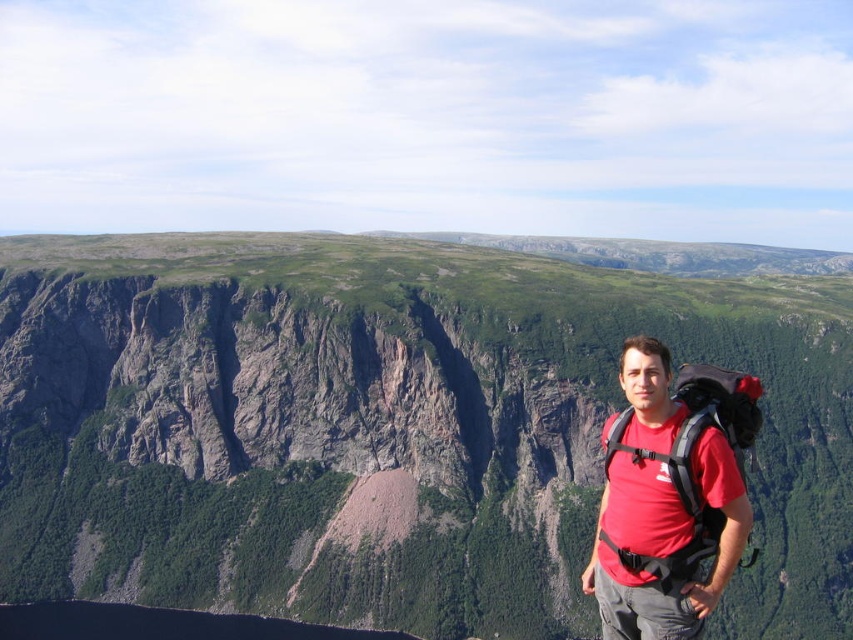
Question: Does green rock cliff at center have a larger size compared to matte black backpack at right?

Choices:
 (A) yes
 (B) no

Answer: (A)

Question: Is green rock cliff at center above matte black backpack at right?

Choices:
 (A) yes
 (B) no

Answer: (A)

Question: Among these objects, which one is nearest to the camera?

Choices:
 (A) matte black backpack at right
 (B) green rock cliff at center

Answer: (A)

Question: Which point appears closest to the camera in this image?

Choices:
 (A) (254, 381)
 (B) (738, 410)

Answer: (B)

Question: Is green rock cliff at center closer to camera compared to matte black backpack at right?

Choices:
 (A) yes
 (B) no

Answer: (B)

Question: Among these points, which one is nearest to the camera?

Choices:
 (A) (606, 438)
 (B) (732, 628)

Answer: (A)